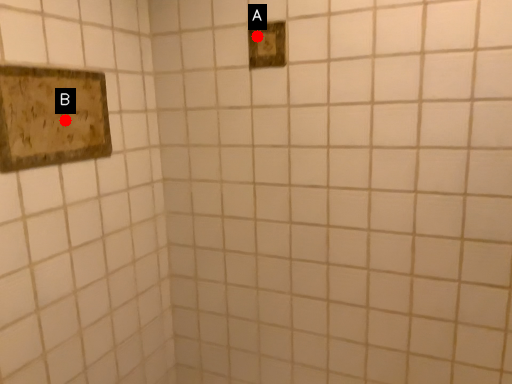
Question: Two points are circled on the image, labeled by A and B beside each circle. Which point appears farthest from the camera in this image?

Choices:
 (A) A is further
 (B) B is further

Answer: (A)